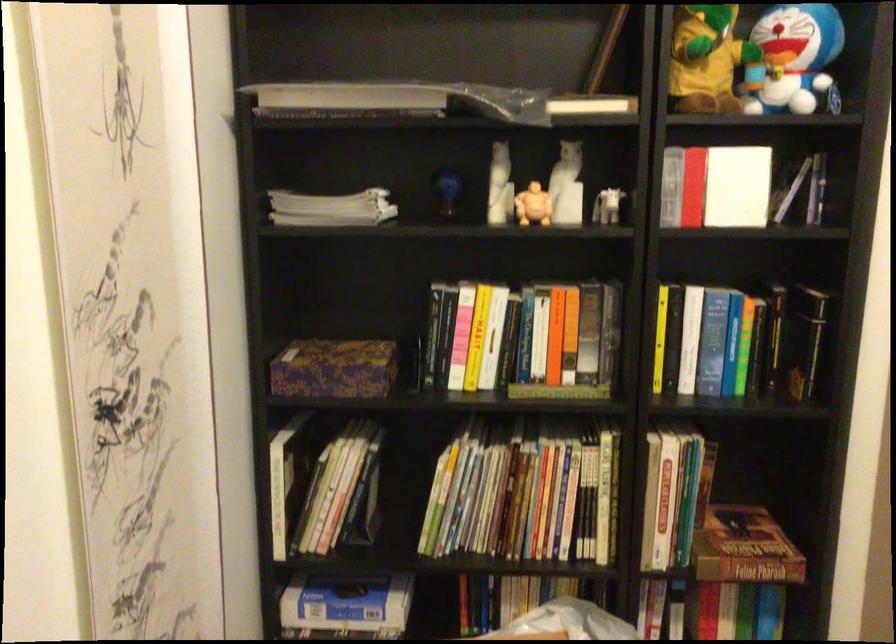
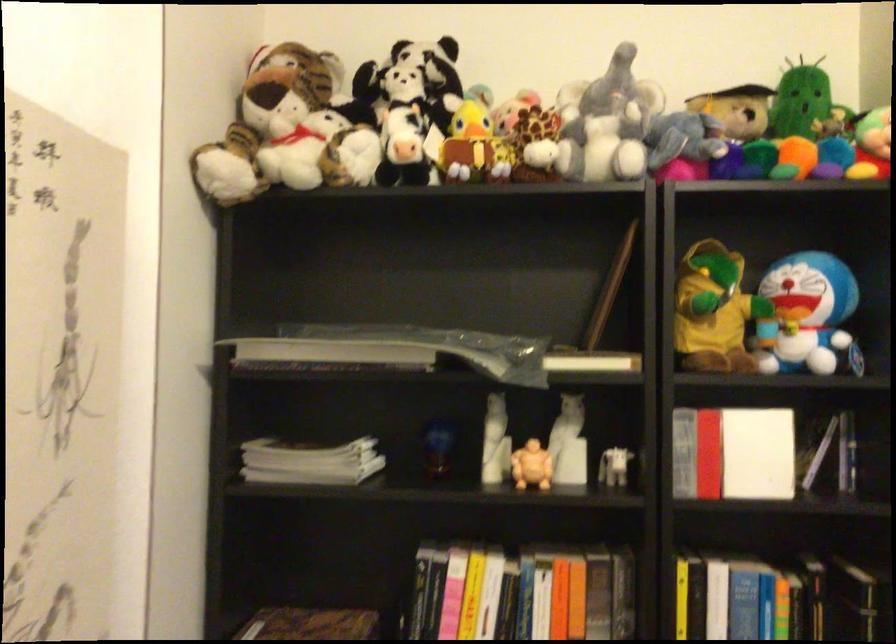
Find the pixel in the second image that matches [591,102] in the first image.

(591, 361)